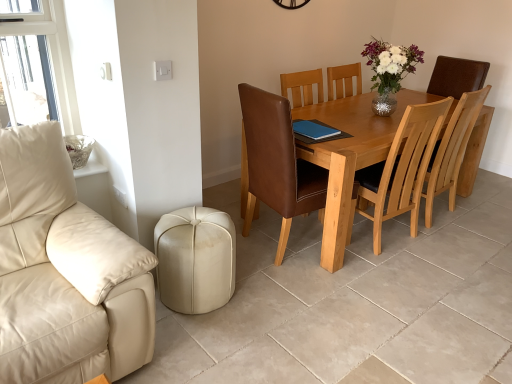
Question: Can you confirm if shiny silver vase at upper center is shorter than blue leather pad at center?

Choices:
 (A) no
 (B) yes

Answer: (A)

Question: From a real-world perspective, does shiny silver vase at upper center sit lower than blue leather pad at center?

Choices:
 (A) no
 (B) yes

Answer: (A)

Question: From the image's perspective, does shiny silver vase at upper center appear lower than blue leather pad at center?

Choices:
 (A) no
 (B) yes

Answer: (A)

Question: Is shiny silver vase at upper center not within blue leather pad at center?

Choices:
 (A) no
 (B) yes

Answer: (B)

Question: Can you confirm if shiny silver vase at upper center is wider than blue leather pad at center?

Choices:
 (A) yes
 (B) no

Answer: (A)

Question: From a real-world perspective, is brown leather chair at center, the 2th chair positioned from the right, physically located above or below light brown wooden table at center?

Choices:
 (A) below
 (B) above

Answer: (B)

Question: In terms of width, does brown leather chair at center, the 2th chair positioned from the right, look wider or thinner when compared to light brown wooden table at center?

Choices:
 (A) wide
 (B) thin

Answer: (B)

Question: Looking at the image, does brown leather chair at center, the 2th chair positioned from the right, seem bigger or smaller compared to light brown wooden table at center?

Choices:
 (A) big
 (B) small

Answer: (B)

Question: Would you say brown leather chair at center, the 2th chair positioned from the right, is inside or outside light brown wooden table at center?

Choices:
 (A) inside
 (B) outside

Answer: (A)

Question: From the image's perspective, is brown leather chair at center, the first chair positioned from the left, located above or below light brown wood chair at center, which ranks as the second chair in left-to-right order?

Choices:
 (A) above
 (B) below

Answer: (B)

Question: Is brown leather chair at center, the 2th chair positioned from the right, in front of or behind light brown wood chair at center, which ranks as the second chair in left-to-right order, in the image?

Choices:
 (A) behind
 (B) front

Answer: (B)

Question: Considering the positions of brown leather chair at center, the 2th chair positioned from the right, and light brown wood chair at center, acting as the 1th chair starting from the right, in the image, is brown leather chair at center, the 2th chair positioned from the right, bigger or smaller than light brown wood chair at center, acting as the 1th chair starting from the right,?

Choices:
 (A) big
 (B) small

Answer: (A)

Question: Do you think brown leather chair at center, the 2th chair positioned from the right, is within light brown wood chair at center, which ranks as the second chair in left-to-right order, or outside of it?

Choices:
 (A) outside
 (B) inside

Answer: (A)

Question: From a real-world perspective, relative to shiny silver vase at upper center, is beige leather ottoman at lower left vertically above or below?

Choices:
 (A) above
 (B) below

Answer: (B)

Question: Is beige leather ottoman at lower left in front of or behind shiny silver vase at upper center in the image?

Choices:
 (A) behind
 (B) front

Answer: (B)